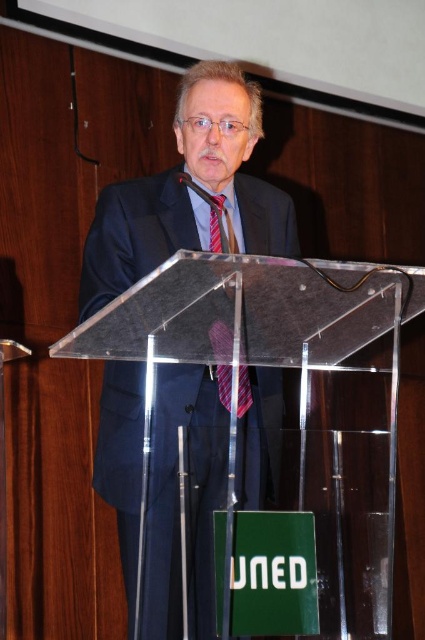
Question: Which of the following is the closest to the observer?

Choices:
 (A) (217, 248)
 (B) (189, 196)

Answer: (A)

Question: Can you confirm if dark blue suit at center is positioned below red striped tie at center?

Choices:
 (A) yes
 (B) no

Answer: (A)

Question: Which of the following is the closest to the observer?

Choices:
 (A) (147, 637)
 (B) (218, 198)

Answer: (A)

Question: Does dark blue suit at center come in front of red striped tie at center?

Choices:
 (A) no
 (B) yes

Answer: (B)

Question: Which point is farther to the camera?

Choices:
 (A) (218, 246)
 (B) (163, 600)

Answer: (A)

Question: Is dark blue suit at center smaller than red striped tie at center?

Choices:
 (A) yes
 (B) no

Answer: (B)